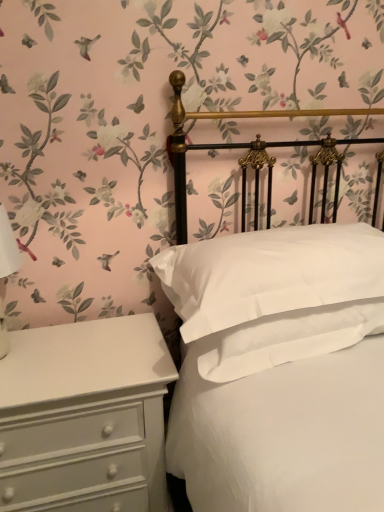
Question: From the image's perspective, is white matte bed at center located above or below white smooth pillow at center?

Choices:
 (A) below
 (B) above

Answer: (A)

Question: Is white matte bed at center to the left or to the right of white smooth pillow at center in the image?

Choices:
 (A) right
 (B) left

Answer: (A)

Question: Considering the real-world distances, which object is farthest from the white matte bed at center?

Choices:
 (A) white painted wood chest of drawers at lower left
 (B) white smooth pillow at center

Answer: (A)

Question: Estimate the real-world distances between objects in this image. Which object is farther from the white matte bed at center?

Choices:
 (A) white painted wood chest of drawers at lower left
 (B) white smooth pillow at center

Answer: (A)